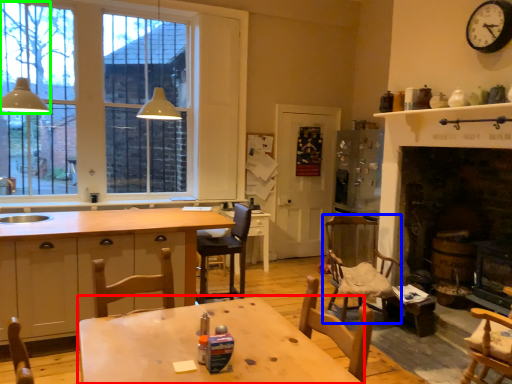
Question: Estimate the real-world distances between objects in this image. Which object is farther from table (highlighted by a red box), chair (highlighted by a blue box) or light fixture (highlighted by a green box)?

Choices:
 (A) chair
 (B) light fixture

Answer: (B)